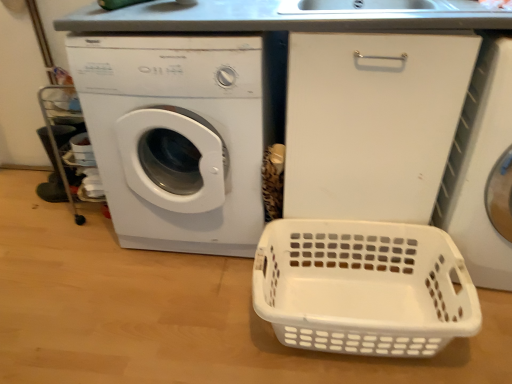
At what (x,y) coordinates should I click in order to perform the action: click on free area below white plastic basket at lower right (from a real-world perspective). Please return your answer as a coordinate pair (x, y). The width and height of the screenshot is (512, 384). Looking at the image, I should click on (353, 310).